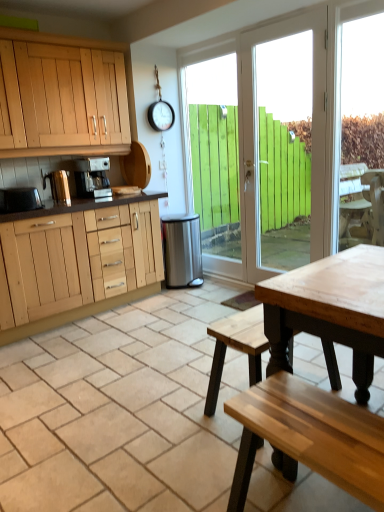
Question: From a real-world perspective, is stainless steel trash can at center, the 3th appliance from the left, positioned above or below white wood door at center?

Choices:
 (A) above
 (B) below

Answer: (B)

Question: In terms of width, does stainless steel trash can at center, which is the first appliance from right to left, look wider or thinner when compared to white wood door at center?

Choices:
 (A) thin
 (B) wide

Answer: (B)

Question: Considering the real-world distances, which object is closest to the stainless steel trash can at center, which is the first appliance from right to left?

Choices:
 (A) brushed metal kettle at left, the 2th appliance viewed from the front
 (B) white wood door at center
 (C) satin silver coffee maker at center
 (D) metallic silver toaster at left, arranged as the 1th appliance when viewed from the front

Answer: (B)

Question: Estimate the real-world distances between objects in this image. Which object is closer to the white wood door at center?

Choices:
 (A) metallic silver toaster at left, the 1th appliance viewed from the left
 (B) satin silver coffee maker at center
 (C) stainless steel trash can at center, which is the first appliance from right to left
 (D) brushed metal kettle at left, the 2th appliance viewed from the front

Answer: (C)